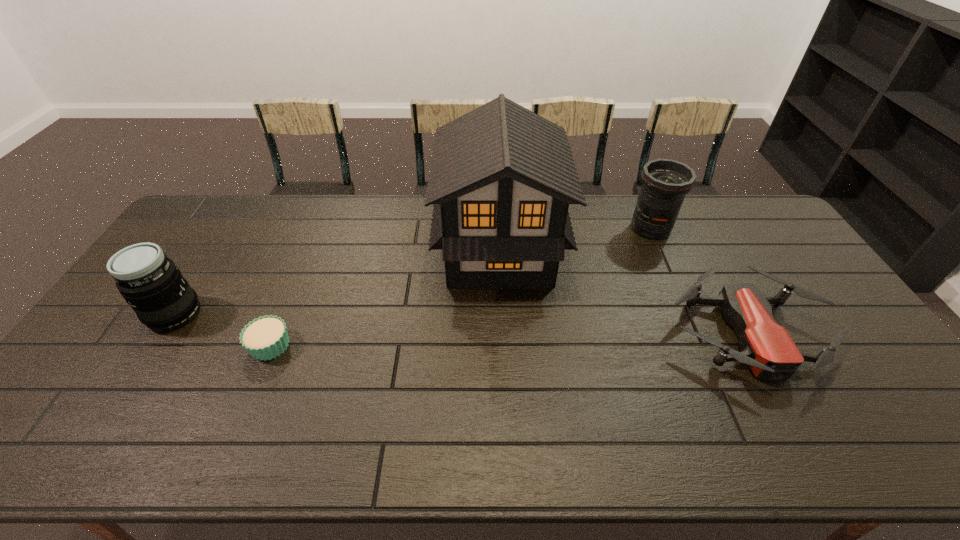
In order to click on the third object from right to left in this screenshot , I will do `click(502, 177)`.

Image resolution: width=960 pixels, height=540 pixels. Find the location of `the tallest object`. the tallest object is located at coordinates (502, 177).

Image resolution: width=960 pixels, height=540 pixels. In order to click on the right telephoto lens in this screenshot , I will do `click(665, 182)`.

Identify the location of the left telephoto lens. The image size is (960, 540). (151, 283).

This screenshot has width=960, height=540. Identify the location of the leftmost object. (151, 283).

Where is `the fourth tallest object`? Image resolution: width=960 pixels, height=540 pixels. the fourth tallest object is located at coordinates (767, 347).

The image size is (960, 540). Find the location of `the second object from left to right`. the second object from left to right is located at coordinates (266, 337).

I want to click on cupcake, so click(266, 337).

Locate an element on the screen. The height and width of the screenshot is (540, 960). free point located 0.070m on the front-facing side of the third object from left to right is located at coordinates (415, 253).

Locate an element on the screen. The width and height of the screenshot is (960, 540). vacant space located 0.390m on the front-facing side of the third object from left to right is located at coordinates (317, 253).